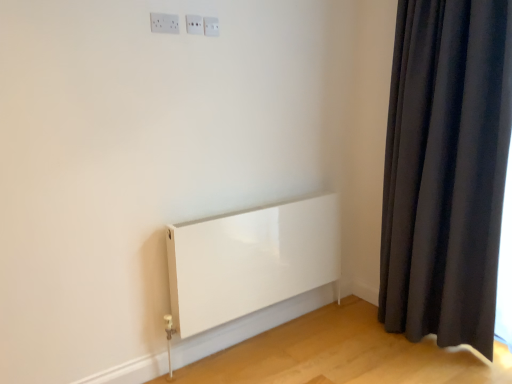
Question: Which direction should I rotate to face white plastic electric outlet at upper center, which is the third electric outlet in left-to-right order, — up or down?

Choices:
 (A) down
 (B) up

Answer: (B)

Question: Is the position of white plastic electric outlet at upper center, marked as the second electric outlet in a front-to-back arrangement, less distant than that of white plastic electric outlet at upper center, the 1th electric outlet positioned from the right?

Choices:
 (A) no
 (B) yes

Answer: (B)

Question: From a real-world perspective, is white plastic electric outlet at upper center, positioned as the second electric outlet in right-to-left order, positioned under white plastic electric outlet at upper center, which is the third electric outlet in left-to-right order, based on gravity?

Choices:
 (A) yes
 (B) no

Answer: (B)

Question: From the image's perspective, is white plastic electric outlet at upper center, arranged as the 2th electric outlet when viewed from the back, located beneath white plastic electric outlet at upper center, which is the third electric outlet in left-to-right order?

Choices:
 (A) no
 (B) yes

Answer: (B)

Question: From the image's perspective, is white plastic electric outlet at upper center, marked as the second electric outlet in a front-to-back arrangement, located above white plastic electric outlet at upper center, which ranks as the 3th electric outlet in front-to-back order?

Choices:
 (A) no
 (B) yes

Answer: (A)

Question: Is white plastic electric outlet at upper center, marked as the second electric outlet in a front-to-back arrangement, looking in the opposite direction of white plastic electric outlet at upper center, which ranks as the 3th electric outlet in front-to-back order?

Choices:
 (A) yes
 (B) no

Answer: (B)

Question: Can you confirm if white plastic electric outlet at upper center, arranged as the second electric outlet when viewed from the left, is wider than white plastic electric outlet at upper center, the 1th electric outlet positioned from the right?

Choices:
 (A) no
 (B) yes

Answer: (A)

Question: Would you say white glossy electric outlet at upper center, the first electric outlet in the left-to-right sequence, is a long distance from white plastic electric outlet at upper center, which ranks as the first electric outlet in back-to-front order?

Choices:
 (A) no
 (B) yes

Answer: (A)

Question: Are white glossy electric outlet at upper center, which appears as the third electric outlet when viewed from the right, and white plastic electric outlet at upper center, which is the third electric outlet in left-to-right order, beside each other?

Choices:
 (A) no
 (B) yes

Answer: (A)

Question: Considering the relative sizes of white glossy electric outlet at upper center, the 1th electric outlet positioned from the front, and white plastic electric outlet at upper center, the 1th electric outlet positioned from the right, in the image provided, is white glossy electric outlet at upper center, the 1th electric outlet positioned from the front, thinner than white plastic electric outlet at upper center, the 1th electric outlet positioned from the right,?

Choices:
 (A) yes
 (B) no

Answer: (B)

Question: From a real-world perspective, is white glossy electric outlet at upper center, the first electric outlet in the left-to-right sequence, located higher than white plastic electric outlet at upper center, the 1th electric outlet positioned from the right?

Choices:
 (A) no
 (B) yes

Answer: (A)

Question: Is white plastic electric outlet at upper center, which ranks as the first electric outlet in back-to-front order, inside white glossy electric outlet at upper center, which appears as the third electric outlet when viewed from the right?

Choices:
 (A) no
 (B) yes

Answer: (A)

Question: Is white glossy electric outlet at upper center, which appears as the third electric outlet when viewed from the right, aimed at white plastic electric outlet at upper center, which ranks as the 3th electric outlet in front-to-back order?

Choices:
 (A) yes
 (B) no

Answer: (B)

Question: From a real-world perspective, is white plastic electric outlet at upper center, which is the third electric outlet in left-to-right order, under white glossy electric outlet at upper center, which appears as the third electric outlet when viewed from the right?

Choices:
 (A) yes
 (B) no

Answer: (B)